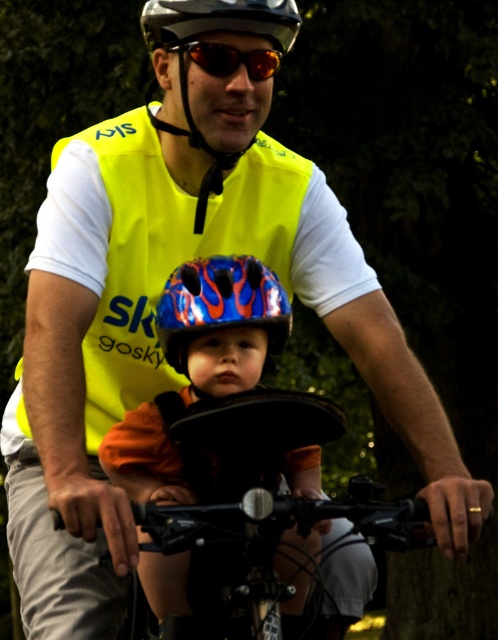
Does point (249, 632) come closer to viewer compared to point (179, 336)?

Yes, point (249, 632) is in front of point (179, 336).

Does point (194, 561) lie behind point (175, 362)?

No, it is in front of (175, 362).

What do you see at coordinates (262, 547) in the screenshot?
I see `black metallic bicycle handlebars at center` at bounding box center [262, 547].

The width and height of the screenshot is (498, 640). In order to click on black metallic bicycle handlebars at center in this screenshot , I will do `click(262, 547)`.

Which is behind, point (129, 422) or point (173, 4)?

Positioned behind is point (173, 4).

Is point (232, 282) positioned before point (191, 24)?

Yes.

Is point (209, 339) farther from viewer compared to point (242, 19)?

No, (209, 339) is closer to viewer.

Find the location of a particular element. This screenshot has width=498, height=640. shiny blue helmet at center is located at coordinates (222, 323).

Does yellow reflective safety vest at center have a lesser height compared to shiny blue helmet at center?

Incorrect, yellow reflective safety vest at center's height does not fall short of shiny blue helmet at center's.

Which is in front, point (136, 129) or point (201, 317)?

Positioned in front is point (201, 317).

In the scene shown: Who is more distant from viewer, (162, 250) or (122, 422)?

Positioned behind is point (162, 250).

This screenshot has height=640, width=498. I want to click on yellow reflective safety vest at center, so click(169, 250).